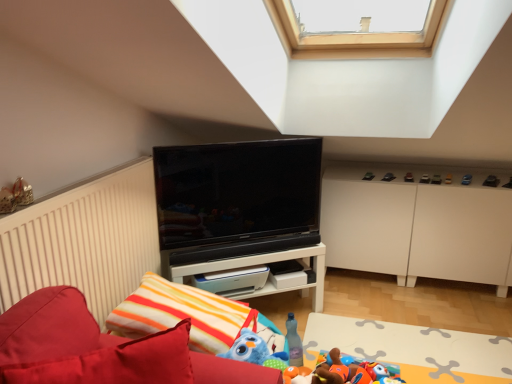
Identify the location of free space to the right of metallic silver toy at upper right, which is counted as the 7th toy, starting from the bottom. The image size is (512, 384). click(467, 175).